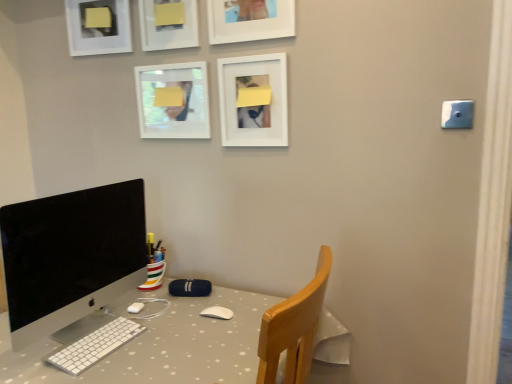
The height and width of the screenshot is (384, 512). I want to click on vacant area that lies to the right of silver metallic monitor at left, so click(x=180, y=329).